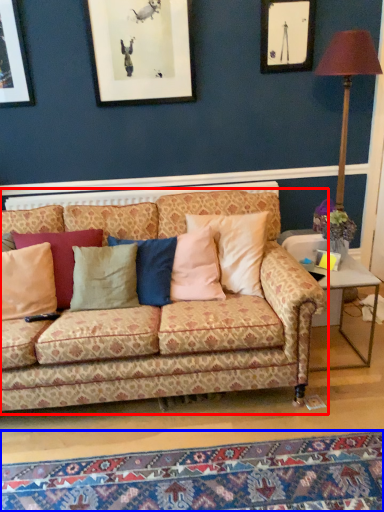
Question: Which point is further to the camera, studio couch (highlighted by a red box) or mat (highlighted by a blue box)?

Choices:
 (A) studio couch
 (B) mat

Answer: (A)